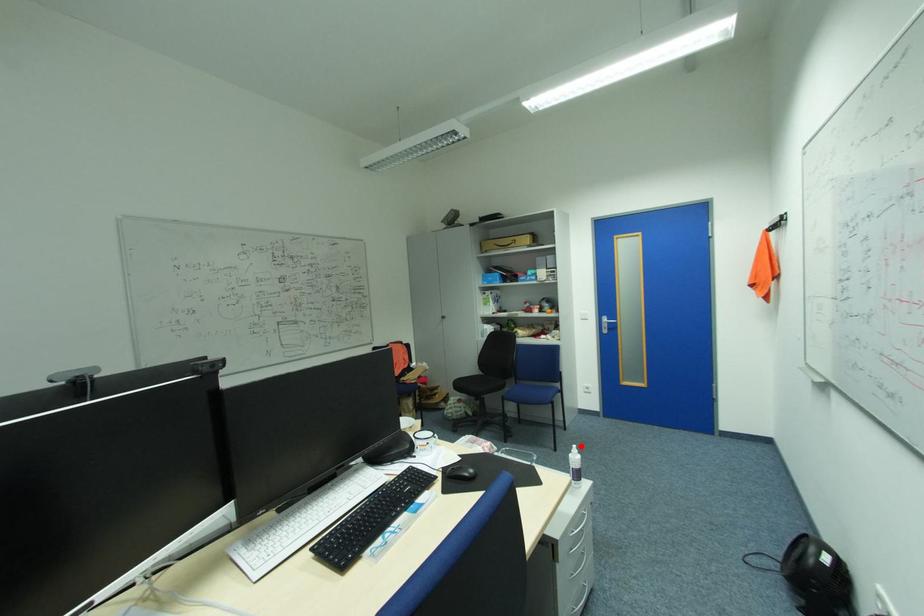
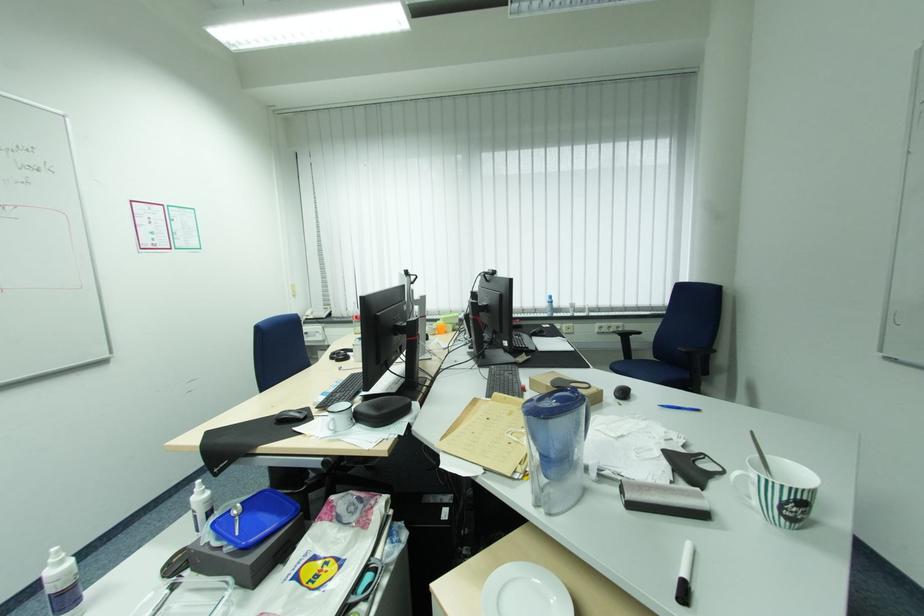
In the second image, find the point that corresponds to the highlighted location in the first image.

(62, 548)